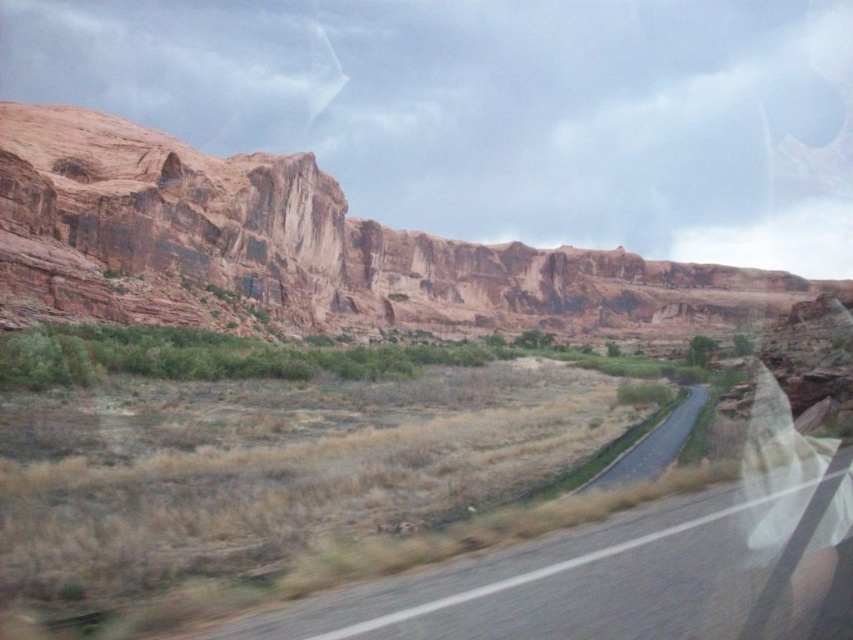
Locate an element on the screen. This screenshot has width=853, height=640. rustic rock formation at upper left is located at coordinates (303, 248).

Who is shorter, rustic rock formation at upper left or gray asphalt road at center?

With less height is gray asphalt road at center.

What are the coordinates of `rustic rock formation at upper left` in the screenshot? It's located at (303, 248).

Which is in front, point (380, 637) or point (628, 460)?

Positioned in front is point (380, 637).

Which is behind, point (430, 596) or point (654, 428)?

Positioned behind is point (654, 428).

Identify the location of gray asphalt road at center. The height and width of the screenshot is (640, 853). (579, 577).

Between rustic rock formation at upper left and black asphalt road at center, which one appears on the left side from the viewer's perspective?

Positioned to the left is black asphalt road at center.

Is the position of rustic rock formation at upper left more distant than that of black asphalt road at center?

Yes.

Is point (138, 305) in front of point (607, 484)?

That is False.

The height and width of the screenshot is (640, 853). Identify the location of rustic rock formation at upper left. (303, 248).